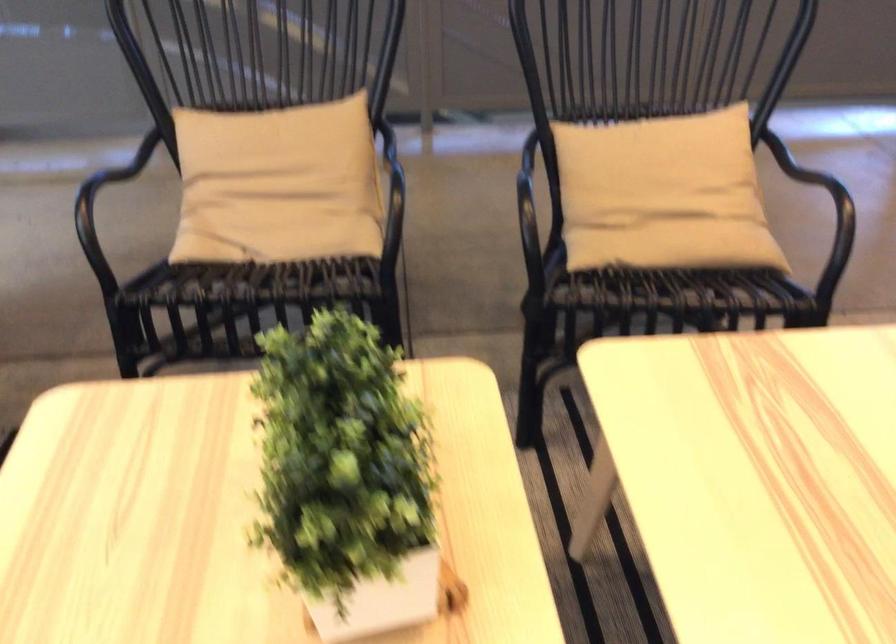
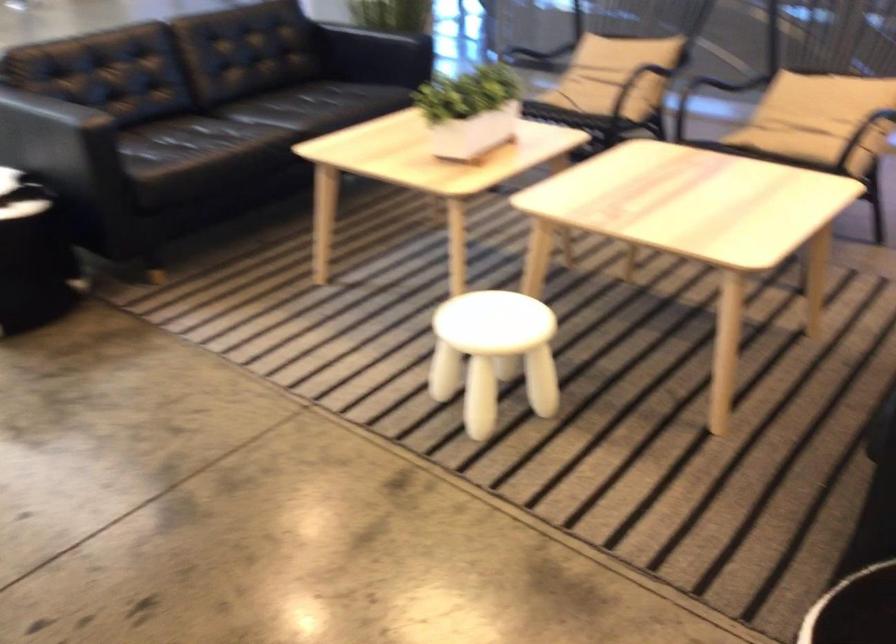
The point at (312, 229) is marked in the first image. Where is the corresponding point in the second image?

(597, 91)